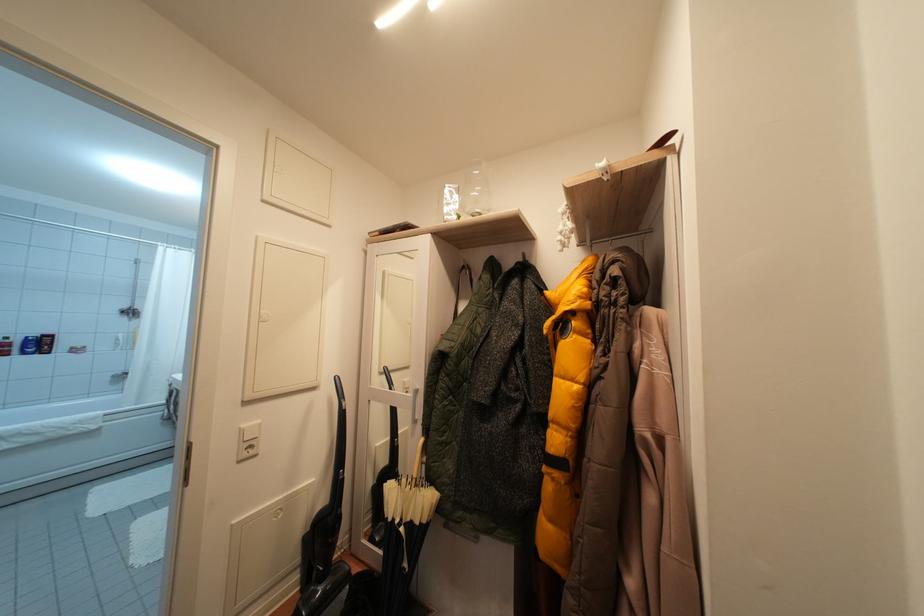
This screenshot has width=924, height=616. What do you see at coordinates (248, 440) in the screenshot?
I see `a white light switch` at bounding box center [248, 440].